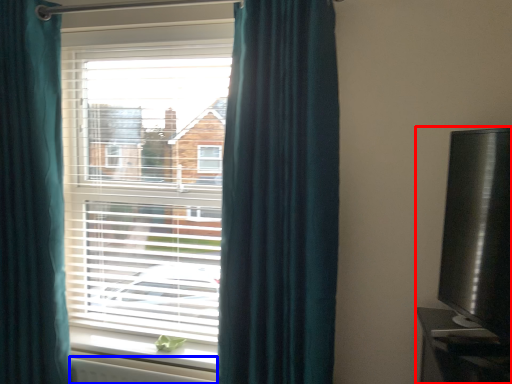
Question: Which point is closer to the camera, entertainment center (highlighted by a red box) or radiator (highlighted by a blue box)?

Choices:
 (A) entertainment center
 (B) radiator

Answer: (A)